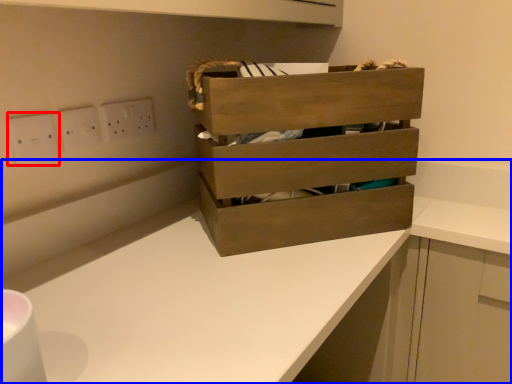
Question: Among these objects, which one is farthest to the camera, electric outlet (highlighted by a red box) or counter (highlighted by a blue box)?

Choices:
 (A) electric outlet
 (B) counter

Answer: (A)